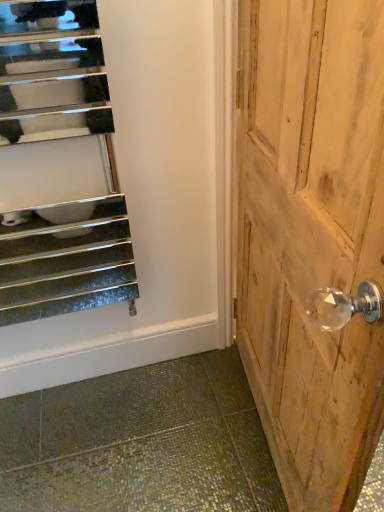
Question: Would you say polished chrome radiator at left is to the left or to the right of wooden door handle at right in the picture?

Choices:
 (A) right
 (B) left

Answer: (B)

Question: Based on their sizes in the image, would you say polished chrome radiator at left is bigger or smaller than wooden door handle at right?

Choices:
 (A) big
 (B) small

Answer: (B)

Question: Considering their positions, is polished chrome radiator at left located in front of or behind wooden door handle at right?

Choices:
 (A) front
 (B) behind

Answer: (B)

Question: Considering the positions of wooden door handle at right and polished chrome radiator at left in the image, is wooden door handle at right bigger or smaller than polished chrome radiator at left?

Choices:
 (A) small
 (B) big

Answer: (B)

Question: In the image, is wooden door handle at right positioned in front of or behind polished chrome radiator at left?

Choices:
 (A) behind
 (B) front

Answer: (B)

Question: Does point (349, 446) appear closer or farther from the camera than point (79, 244)?

Choices:
 (A) closer
 (B) farther

Answer: (A)

Question: Would you say wooden door handle at right is to the left or to the right of polished chrome radiator at left in the picture?

Choices:
 (A) right
 (B) left

Answer: (A)